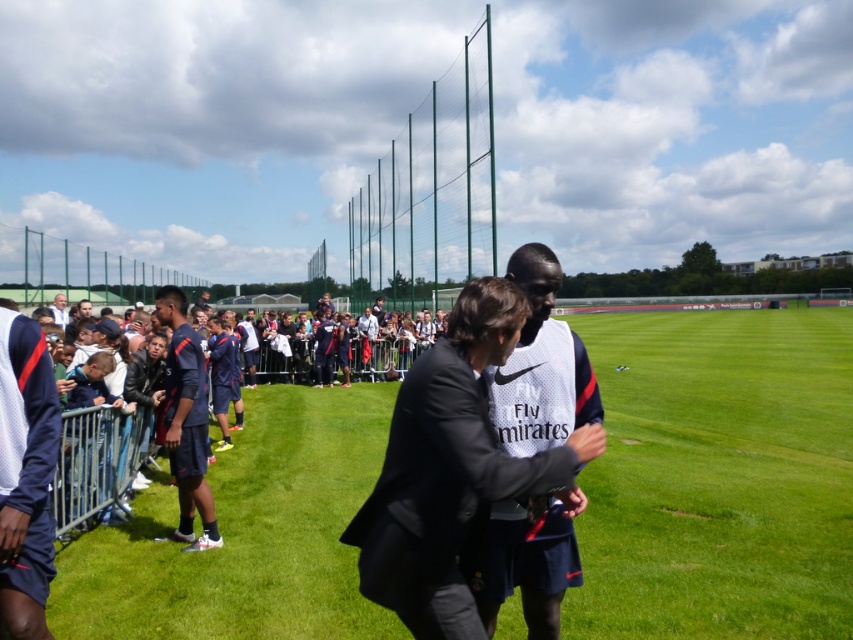
Question: Among these objects, which one is farthest from the camera?

Choices:
 (A) white matte jersey at center
 (B) white matte jersey at left

Answer: (B)

Question: Is white mesh jersey at center to the left of white matte jersey at left from the viewer's perspective?

Choices:
 (A) yes
 (B) no

Answer: (B)

Question: Observing the image, what is the correct spatial positioning of white matte jersey at left in reference to dark blue jersey at center?

Choices:
 (A) left
 (B) right

Answer: (B)

Question: Which of the following is the farthest from the observer?

Choices:
 (A) (570, 406)
 (B) (9, 397)
 (C) (184, 456)
 (D) (51, 307)

Answer: (D)

Question: Can you confirm if white mesh jersey at center is bigger than dark blue jersey at center?

Choices:
 (A) no
 (B) yes

Answer: (B)

Question: Which object is farther from the camera taking this photo?

Choices:
 (A) white mesh jersey at center
 (B) white matte jersey at center

Answer: (A)